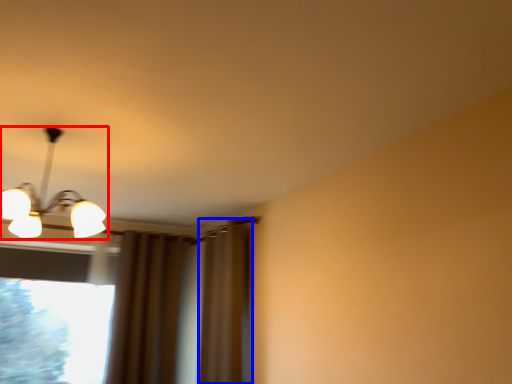
Question: Which object appears closest to the camera in this image, lamp (highlighted by a red box) or curtain (highlighted by a blue box)?

Choices:
 (A) lamp
 (B) curtain

Answer: (A)